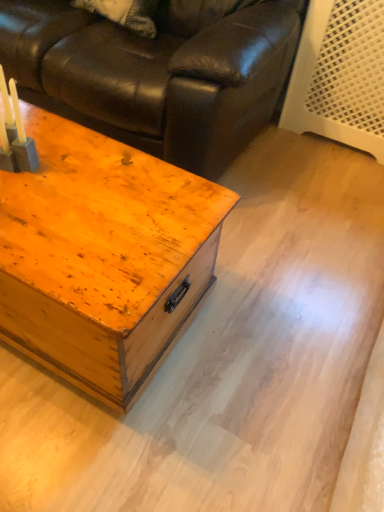
Question: In terms of width, does matte black leather couch at upper left look wider or thinner when compared to wooden trunk at center?

Choices:
 (A) thin
 (B) wide

Answer: (B)

Question: Is matte black leather couch at upper left bigger or smaller than wooden trunk at center?

Choices:
 (A) big
 (B) small

Answer: (A)

Question: Considering the real-world distances, which object is closest to the matte gray candle holder at left?

Choices:
 (A) wooden trunk at center
 (B) matte black leather couch at upper left

Answer: (A)

Question: Which of these objects is positioned farthest from the matte black leather couch at upper left?

Choices:
 (A) matte gray candle holder at left
 (B) wooden trunk at center

Answer: (A)